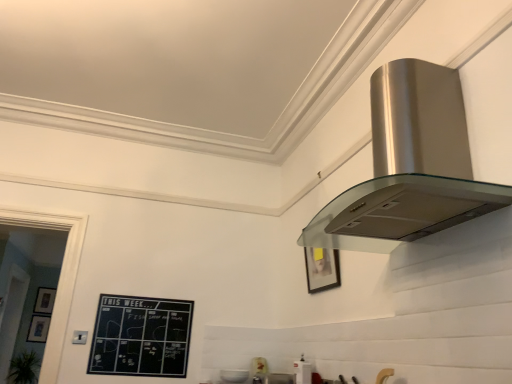
Question: From a real-world perspective, is satin silver range hood at upper right located higher than matte black picture frame at lower left, acting as the 1th picture frame starting from the bottom?

Choices:
 (A) yes
 (B) no

Answer: (A)

Question: Could you tell me if satin silver range hood at upper right is facing matte black picture frame at lower left, the 2th picture frame viewed from the back?

Choices:
 (A) yes
 (B) no

Answer: (B)

Question: From the image's perspective, does satin silver range hood at upper right appear lower than matte black picture frame at lower left, which is the 1th picture frame in left-to-right order?

Choices:
 (A) no
 (B) yes

Answer: (A)

Question: Is satin silver range hood at upper right smaller than matte black picture frame at lower left, the 2th picture frame viewed from the back?

Choices:
 (A) yes
 (B) no

Answer: (B)

Question: Considering the relative sizes of satin silver range hood at upper right and matte black picture frame at lower left, the 2th picture frame viewed from the back, in the image provided, is satin silver range hood at upper right thinner than matte black picture frame at lower left, the 2th picture frame viewed from the back,?

Choices:
 (A) yes
 (B) no

Answer: (B)

Question: In the image, is satin silver range hood at upper right positioned in front of or behind satin silver range hood at upper right, which appears as the first appliance when viewed from the left?

Choices:
 (A) front
 (B) behind

Answer: (A)

Question: Is satin silver range hood at upper right taller or shorter than satin silver range hood at upper right, which appears as the first appliance when viewed from the left?

Choices:
 (A) tall
 (B) short

Answer: (A)

Question: Considering the positions of satin silver range hood at upper right and satin silver range hood at upper right, which is the second appliance from back to front, in the image, is satin silver range hood at upper right bigger or smaller than satin silver range hood at upper right, which is the second appliance from back to front,?

Choices:
 (A) small
 (B) big

Answer: (B)

Question: From a real-world perspective, is satin silver range hood at upper right positioned above or below satin silver range hood at upper right, which appears as the first appliance when viewed from the left?

Choices:
 (A) below
 (B) above

Answer: (B)

Question: From a real-world perspective, is satin silver range hood at upper right, arranged as the 3th appliance when viewed from the back, positioned above or below satin silver range hood at upper right, which appears as the first appliance when viewed from the left?

Choices:
 (A) above
 (B) below

Answer: (B)

Question: Is satin silver range hood at upper right, arranged as the 3th appliance when viewed from the back, wider or thinner than satin silver range hood at upper right, which appears as the first appliance when viewed from the left?

Choices:
 (A) thin
 (B) wide

Answer: (A)

Question: In the image, is satin silver range hood at upper right, which is the first appliance from right to left, positioned in front of or behind satin silver range hood at upper right, the 2th appliance viewed from the front?

Choices:
 (A) behind
 (B) front

Answer: (B)

Question: Which is correct: satin silver range hood at upper right, the first appliance viewed from the front, is inside satin silver range hood at upper right, which is counted as the third appliance, starting from the right, or outside of it?

Choices:
 (A) inside
 (B) outside

Answer: (B)

Question: Would you say matte black picture frame at lower left, acting as the 1th picture frame starting from the bottom, is to the left or to the right of satin silver range hood at upper right, which is the second appliance from back to front, in the picture?

Choices:
 (A) left
 (B) right

Answer: (A)

Question: From the image's perspective, is matte black picture frame at lower left, the third picture frame positioned from the top, positioned above or below satin silver range hood at upper right, which appears as the first appliance when viewed from the left?

Choices:
 (A) above
 (B) below

Answer: (B)